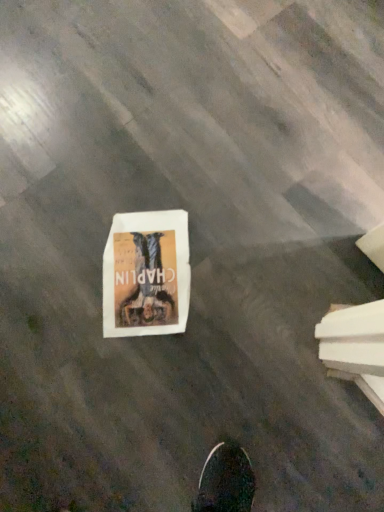
The image size is (384, 512). Find the location of `free space to the back side of white paper comic book at center`. free space to the back side of white paper comic book at center is located at coordinates (131, 160).